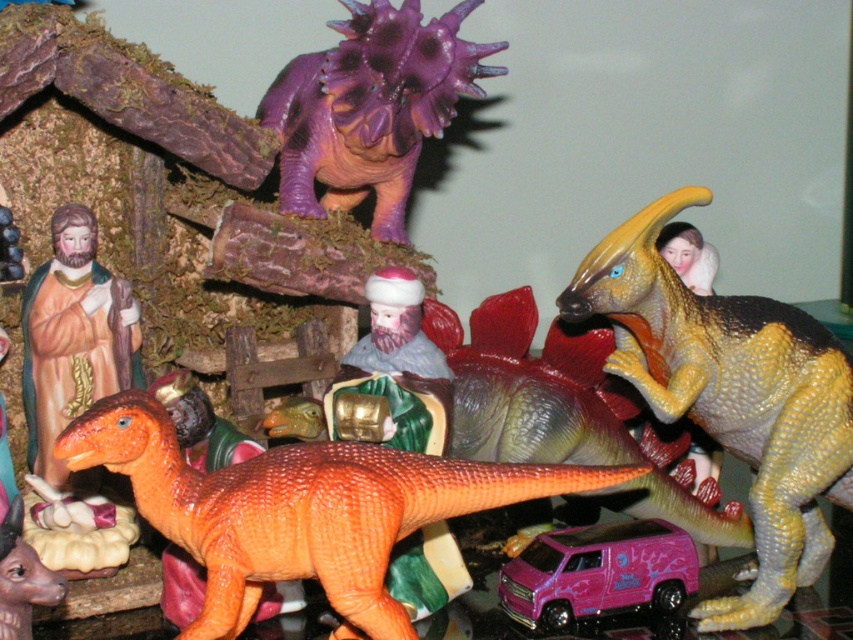
You are standing in front of the nativity scene and notice two points marked in the image. The first point is at coordinates point [218,611], and the second is at point [695,356]. Which of these points is closer to you?

Point [218,611] is in front of point [695,356], so it is closer to you.